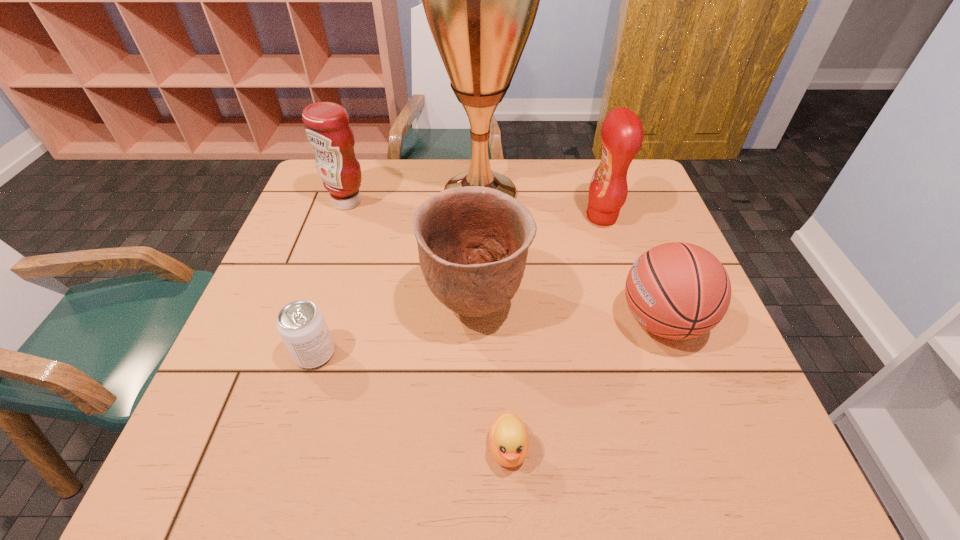
Locate an element on the screen. free region located on the label side of the right condiment is located at coordinates (502, 217).

Where is `free location located on the label side of the right condiment`? The width and height of the screenshot is (960, 540). free location located on the label side of the right condiment is located at coordinates (538, 217).

Find the location of a particular element. free location located 0.310m on the front of the left condiment is located at coordinates (314, 298).

Locate an element on the screen. This screenshot has width=960, height=540. vacant position located on the right of the pottery is located at coordinates (633, 306).

Identify the location of free space located 0.230m on the logo side of the basketball. (513, 321).

Where is `free space located on the logo side of the basketball`? Image resolution: width=960 pixels, height=540 pixels. free space located on the logo side of the basketball is located at coordinates (481, 321).

Locate an element on the screen. The height and width of the screenshot is (540, 960). blank space located on the logo side of the basketball is located at coordinates (549, 321).

The width and height of the screenshot is (960, 540). What are the coordinates of `free spot located on the back of the soda can` in the screenshot? It's located at (344, 260).

Where is `trophy cup located in the far edge section of the desktop`? This screenshot has height=540, width=960. trophy cup located in the far edge section of the desktop is located at coordinates (480, 0).

The height and width of the screenshot is (540, 960). What are the coordinates of `object that is at the near edge` in the screenshot? It's located at (508, 438).